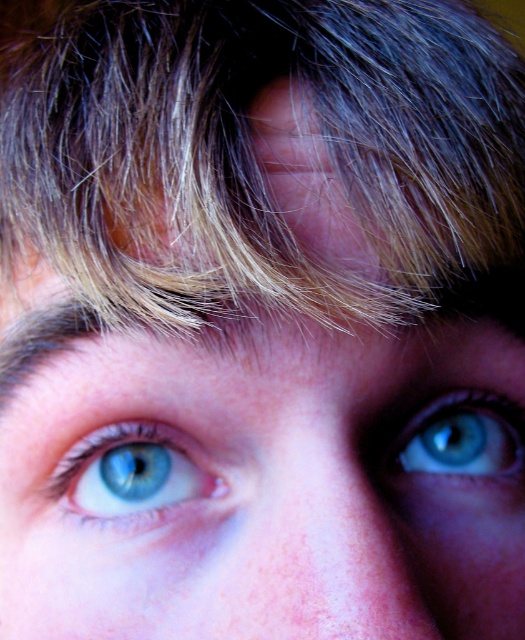
Based on the photo, you are an artist trying to sketch this portrait. You need to place the blonde hair at upper center and the blue glossy eye at upper right. Based on the scene, which object should you draw first to ensure proper positioning?

You should draw the blonde hair at upper center first because it is positioned to the left of the blue glossy eye at upper right, so starting with the left side ensures correct placement.

You are a photographer trying to adjust the lighting to highlight the subject. You notice a point at coordinates point [257,160]. Where exactly is this point located in relation to the subject?

The point [257,160] is located on the blonde hair at upper center.